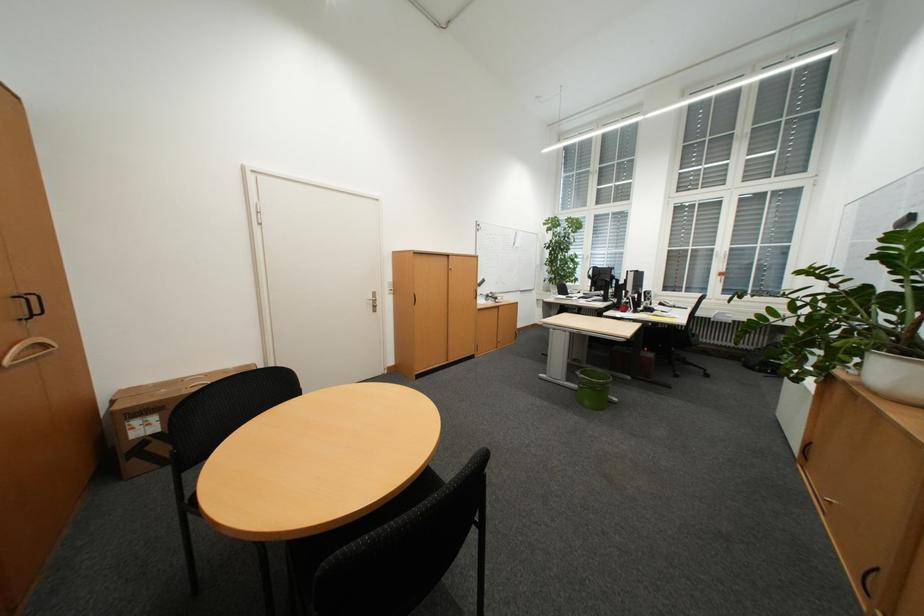
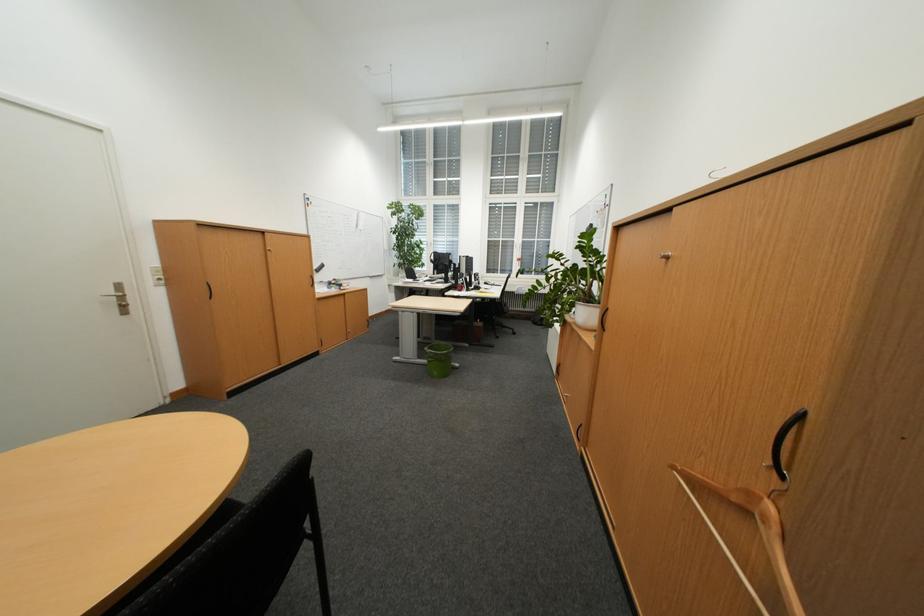
Question: The first image is from the beginning of the video and the second image is from the end. How did the camera likely rotate when shooting the video?

Choices:
 (A) Left
 (B) Right
 (C) Up
 (D) Down

Answer: (B)